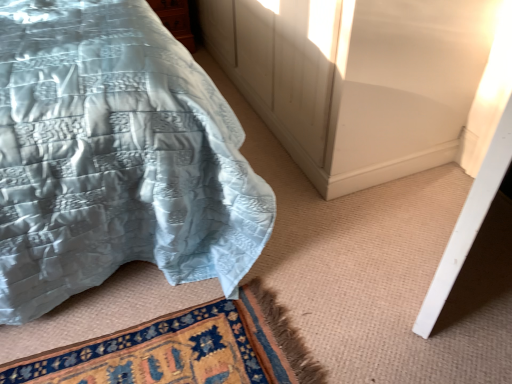
Locate an element on the screen. Image resolution: width=512 pixels, height=384 pixels. silky blue quilt at upper left is located at coordinates (115, 157).

Image resolution: width=512 pixels, height=384 pixels. Describe the element at coordinates (115, 157) in the screenshot. I see `silky blue quilt at upper left` at that location.

What is the approximate width of silky blue quilt at upper left?

The width of silky blue quilt at upper left is 2.29 meters.

The height and width of the screenshot is (384, 512). Describe the element at coordinates (175, 20) in the screenshot. I see `wooden cabinet at upper left` at that location.

In order to face wooden cabinet at upper left, should I rotate leftwards or rightwards?

Turn left by 12.057 degrees to look at wooden cabinet at upper left.

What are the coordinates of `wooden cabinet at upper left` in the screenshot? It's located at (175, 20).

Identify the location of silky blue quilt at upper left. This screenshot has width=512, height=384. (115, 157).

Is silky blue quilt at upper left to the left of wooden cabinet at upper left from the viewer's perspective?

Yes.

Considering their positions, is silky blue quilt at upper left located in front of or behind wooden cabinet at upper left?

Clearly, silky blue quilt at upper left is in front of wooden cabinet at upper left.

Between point (123, 187) and point (170, 3), which one is positioned in front?

Point (123, 187)

From the image's perspective, is silky blue quilt at upper left positioned above or below wooden cabinet at upper left?

silky blue quilt at upper left is situated lower than wooden cabinet at upper left in the image.

From a real-world perspective, does silky blue quilt at upper left stand above wooden cabinet at upper left?

Yes, from a real-world perspective, silky blue quilt at upper left is over wooden cabinet at upper left

Does silky blue quilt at upper left have a lesser width compared to wooden cabinet at upper left?

In fact, silky blue quilt at upper left might be wider than wooden cabinet at upper left.

Considering the relative sizes of silky blue quilt at upper left and wooden cabinet at upper left in the image provided, is silky blue quilt at upper left taller than wooden cabinet at upper left?

Yes.

Considering the relative sizes of silky blue quilt at upper left and wooden cabinet at upper left in the image provided, is silky blue quilt at upper left smaller than wooden cabinet at upper left?

No, silky blue quilt at upper left is not smaller than wooden cabinet at upper left.

Based on the photo, is wooden cabinet at upper left inside silky blue quilt at upper left?

No, wooden cabinet at upper left is not a part of silky blue quilt at upper left.

Is silky blue quilt at upper left beside wooden cabinet at upper left?

No, silky blue quilt at upper left is not touching wooden cabinet at upper left.

Is wooden cabinet at upper left at the back of silky blue quilt at upper left?

That's not correct — silky blue quilt at upper left is not looking away from wooden cabinet at upper left.

This screenshot has height=384, width=512. Find the location of `cabinetry on the right of silky blue quilt at upper left`. cabinetry on the right of silky blue quilt at upper left is located at coordinates (175, 20).

Visually, is wooden cabinet at upper left positioned to the left or to the right of silky blue quilt at upper left?

In the image, wooden cabinet at upper left appears on the right side of silky blue quilt at upper left.

Which is in front, wooden cabinet at upper left or silky blue quilt at upper left?

silky blue quilt at upper left is in front.

Is point (163, 13) positioned after point (156, 33)?

Yes.

From the image's perspective, between wooden cabinet at upper left and silky blue quilt at upper left, which one is located above?

wooden cabinet at upper left, from the image's perspective.

From a real-world perspective, is wooden cabinet at upper left physically below silky blue quilt at upper left?

Yes.

Considering the sizes of objects wooden cabinet at upper left and silky blue quilt at upper left in the image provided, who is wider, wooden cabinet at upper left or silky blue quilt at upper left?

silky blue quilt at upper left is wider.

Can you confirm if wooden cabinet at upper left is shorter than silky blue quilt at upper left?

Yes.

Is wooden cabinet at upper left smaller than silky blue quilt at upper left?

Correct, wooden cabinet at upper left occupies less space than silky blue quilt at upper left.

Is wooden cabinet at upper left completely or partially outside of silky blue quilt at upper left?

Absolutely, wooden cabinet at upper left is external to silky blue quilt at upper left.

Is wooden cabinet at upper left far away from silky blue quilt at upper left?

Indeed, wooden cabinet at upper left is not near silky blue quilt at upper left.

Is wooden cabinet at upper left facing away from silky blue quilt at upper left?

No, wooden cabinet at upper left's orientation is not away from silky blue quilt at upper left.

In the scene shown: What's the angular difference between wooden cabinet at upper left and silky blue quilt at upper left's facing directions?

The angular difference between wooden cabinet at upper left and silky blue quilt at upper left is 2.51e-05 degrees.

Where is `cabinetry behind the silky blue quilt at upper left`? The height and width of the screenshot is (384, 512). cabinetry behind the silky blue quilt at upper left is located at coordinates tap(175, 20).

This screenshot has width=512, height=384. I want to click on bed in front of the wooden cabinet at upper left, so click(115, 157).

The width and height of the screenshot is (512, 384). I want to click on bed on the left side of wooden cabinet at upper left, so pyautogui.click(x=115, y=157).